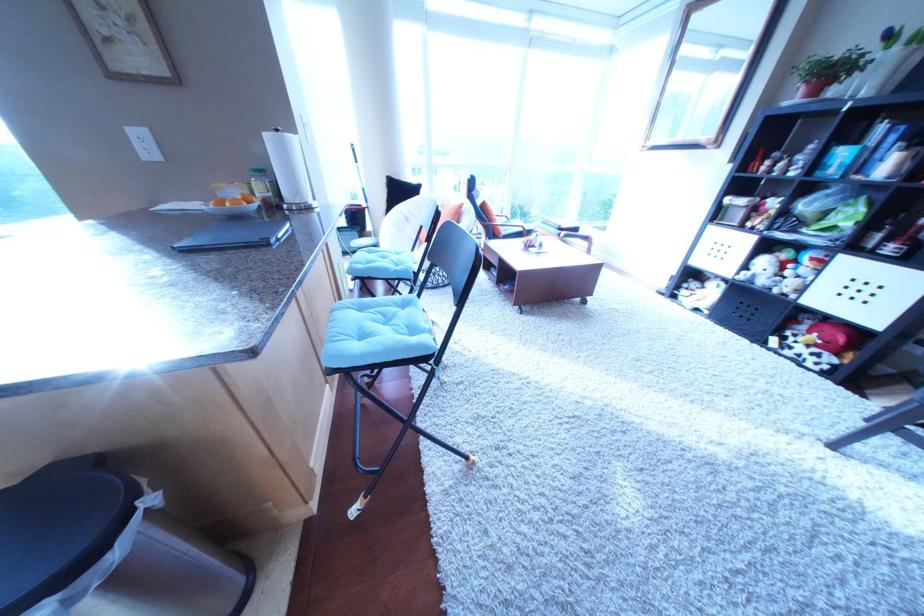
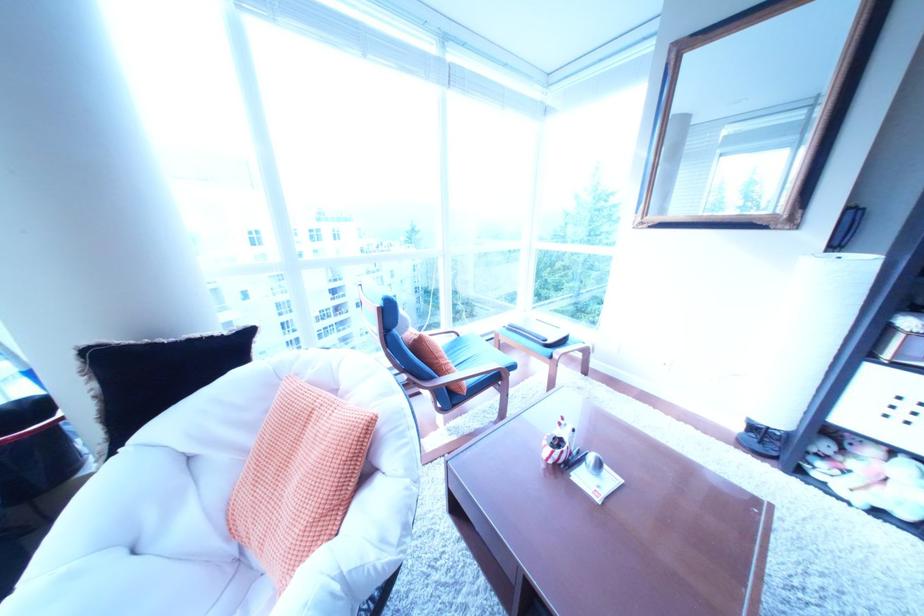
Question: In a continuous first-person perspective shot, in which direction is the camera moving?

Choices:
 (A) Left
 (B) Right
 (C) Forward
 (D) Backward

Answer: (C)